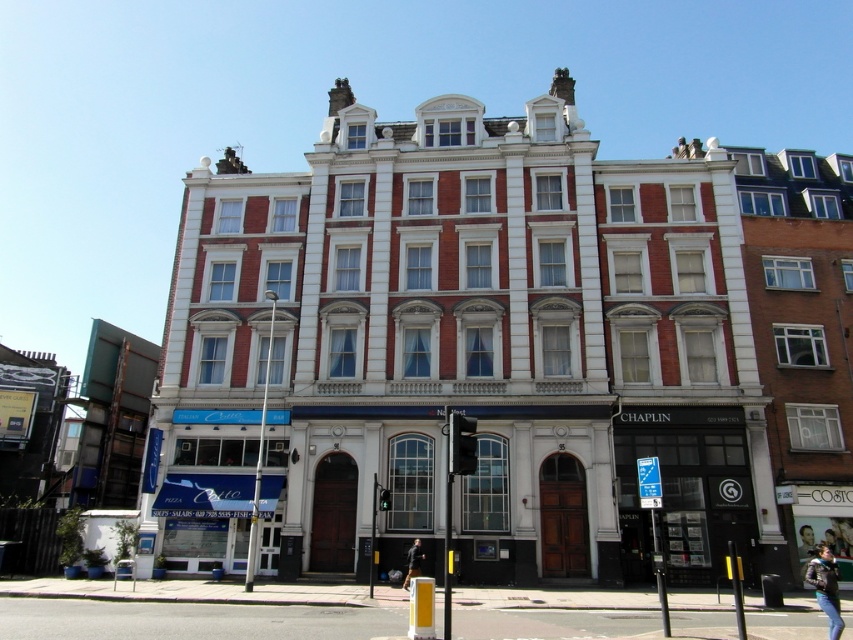
Question: Among these points, which one is nearest to the camera?

Choices:
 (A) (415, 576)
 (B) (828, 560)

Answer: (B)

Question: Based on their relative distances, which object is farther from the smooth skin face at center?

Choices:
 (A) leather jacket at lower right
 (B) black leather jacket at lower center

Answer: (B)

Question: Does leather jacket at lower right appear on the left side of black leather jacket at lower center?

Choices:
 (A) yes
 (B) no

Answer: (B)

Question: Which of the following is the farthest from the observer?

Choices:
 (A) smooth skin face at center
 (B) leather jacket at lower right

Answer: (A)

Question: Is leather jacket at lower right smaller than black leather jacket at lower center?

Choices:
 (A) yes
 (B) no

Answer: (B)

Question: Is leather jacket at lower right closer to camera compared to smooth skin face at center?

Choices:
 (A) yes
 (B) no

Answer: (A)